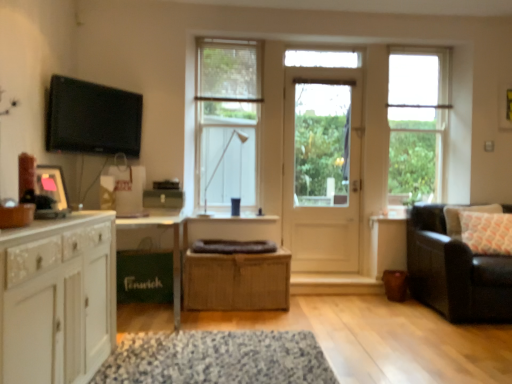
Identify the location of leather couch at right. (455, 272).

Measure the distance between point (316, 224) and camera.

Point (316, 224) is 13.48 feet away from camera.

The image size is (512, 384). Identify the location of white wooden door at center. (322, 168).

Measure the distance between point [200,350] and camera.

They are 2.49 meters apart.

This screenshot has width=512, height=384. In order to click on bamboo cabinet at center, the first cabinetry positioned from the right in this screenshot , I will do `click(236, 281)`.

The image size is (512, 384). Describe the element at coordinates (220, 162) in the screenshot. I see `matte white lamp at center` at that location.

The height and width of the screenshot is (384, 512). Find the location of `matte black picture frame at left`. matte black picture frame at left is located at coordinates (51, 192).

Does point (400, 158) lie in front of point (174, 350)?

That is False.

Looking at this image, what's the angular difference between clear glass window at upper right, acting as the 2th window starting from the left, and speckled fabric mat at center's facing directions?

There is a 0.734-degree angle between the facing directions of clear glass window at upper right, acting as the 2th window starting from the left, and speckled fabric mat at center.

Is clear glass window at upper right, placed as the first window when sorted from right to left, to the left of speckled fabric mat at center from the viewer's perspective?

Incorrect, clear glass window at upper right, placed as the first window when sorted from right to left, is not on the left side of speckled fabric mat at center.

Who is taller, white wood cabinet at left, the 1th cabinetry when ordered from front to back, or flat screen tv at upper left?

With more height is white wood cabinet at left, the 1th cabinetry when ordered from front to back.

Considering the relative sizes of white wood cabinet at left, the second cabinetry when ordered from back to front, and flat screen tv at upper left in the image provided, is white wood cabinet at left, the second cabinetry when ordered from back to front, thinner than flat screen tv at upper left?

In fact, white wood cabinet at left, the second cabinetry when ordered from back to front, might be wider than flat screen tv at upper left.

Considering their positions, is white wood cabinet at left, which appears as the first cabinetry when viewed from the left, located in front of or behind flat screen tv at upper left?

Clearly, white wood cabinet at left, which appears as the first cabinetry when viewed from the left, is in front of flat screen tv at upper left.

Is white wood cabinet at left, the second cabinetry when ordered from back to front, oriented away from flat screen tv at upper left?

No, white wood cabinet at left, the second cabinetry when ordered from back to front, is not facing away from flat screen tv at upper left.

Is leather couch at right touching clear glass window at center, which is counted as the 1th window, starting from the left?

No, leather couch at right is not touching clear glass window at center, which is counted as the 1th window, starting from the left.

This screenshot has height=384, width=512. Identify the location of studio couch directly beneath the clear glass window at center, marked as the 2th window in a right-to-left arrangement (from a real-world perspective). click(455, 272).

From the image's perspective, between leather couch at right and clear glass window at center, marked as the 2th window in a right-to-left arrangement, which one is located above?

clear glass window at center, marked as the 2th window in a right-to-left arrangement, is shown above in the image.

Is leather couch at right smaller than clear glass window at center, marked as the 2th window in a right-to-left arrangement?

No.

Is white wood cabinet at left, the 2th cabinetry when ordered from right to left, completely or partially inside matte black picture frame at left?

That's incorrect, white wood cabinet at left, the 2th cabinetry when ordered from right to left, is not inside matte black picture frame at left.

Does matte black picture frame at left appear on the right side of white wood cabinet at left, the 2th cabinetry when ordered from right to left?

No.

From a real-world perspective, between matte black picture frame at left and white wood cabinet at left, the 1th cabinetry when ordered from front to back, who is vertically lower?

In real-world perspective, white wood cabinet at left, the 1th cabinetry when ordered from front to back, is lower.

From the image's perspective, is patterned fabric pillow at right located above matte white lamp at center?

Incorrect, from the image's perspective, patterned fabric pillow at right is lower than matte white lamp at center.

Is patterned fabric pillow at right shorter than matte white lamp at center?

Yes, patterned fabric pillow at right is shorter than matte white lamp at center.

Is matte white lamp at center at the back of patterned fabric pillow at right?

No, patterned fabric pillow at right is not facing away from matte white lamp at center.

Does point (209, 199) appear closer or farther from the camera than point (283, 294)?

Point (209, 199) is positioned farther from the camera compared to point (283, 294).

Considering the relative sizes of clear glass window at center, which is counted as the 1th window, starting from the left, and bamboo cabinet at center, marked as the 2th cabinetry in a left-to-right arrangement, in the image provided, is clear glass window at center, which is counted as the 1th window, starting from the left, wider than bamboo cabinet at center, marked as the 2th cabinetry in a left-to-right arrangement,?

In fact, clear glass window at center, which is counted as the 1th window, starting from the left, might be narrower than bamboo cabinet at center, marked as the 2th cabinetry in a left-to-right arrangement.

Does clear glass window at center, marked as the 2th window in a right-to-left arrangement, appear on the left side of bamboo cabinet at center, acting as the first cabinetry starting from the back?

Yes, clear glass window at center, marked as the 2th window in a right-to-left arrangement, is to the left of bamboo cabinet at center, acting as the first cabinetry starting from the back.

Find the location of a particular element. window that appears on the left of bamboo cabinet at center, marked as the 2th cabinetry in a left-to-right arrangement is located at coordinates (227, 120).

From a real-world perspective, who is located higher, white wood cabinet at left, the second cabinetry when ordered from back to front, or clear glass window at upper right, acting as the 2th window starting from the left?

In real-world perspective, clear glass window at upper right, acting as the 2th window starting from the left, is above.

Is white wood cabinet at left, the 2th cabinetry when ordered from right to left, beside clear glass window at upper right, placed as the first window when sorted from right to left?

No, white wood cabinet at left, the 2th cabinetry when ordered from right to left, is not beside clear glass window at upper right, placed as the first window when sorted from right to left.

Looking at this image, is white wood cabinet at left, the second cabinetry when ordered from back to front, wider or thinner than clear glass window at upper right, acting as the 2th window starting from the left?

white wood cabinet at left, the second cabinetry when ordered from back to front, is wider than clear glass window at upper right, acting as the 2th window starting from the left.

Identify the location of mat that is under the clear glass window at upper right, placed as the first window when sorted from right to left (from a real-world perspective). (217, 358).

Find the location of a particular element. cabinetry that is the 1st one when counting rightward from the flat screen tv at upper left is located at coordinates [x=57, y=298].

When comparing their distances from white wood cabinet at left, the second cabinetry when ordered from back to front, does patterned fabric pillow at right or bamboo cabinet at center, acting as the first cabinetry starting from the back, seem closer?

bamboo cabinet at center, acting as the first cabinetry starting from the back, lies closer to white wood cabinet at left, the second cabinetry when ordered from back to front, than the other object.

Based on their spatial positions, is leather couch at right or matte black picture frame at left closer to white wooden door at center?

Among the two, leather couch at right is located nearer to white wooden door at center.

In the scene shown: Based on their spatial positions, is white wooden door at center or flat screen tv at upper left closer to leather couch at right?

white wooden door at center is positioned closer to the anchor leather couch at right.

Based on their spatial positions, is white wooden door at center or matte white lamp at center further from speckled fabric mat at center?

matte white lamp at center is further to speckled fabric mat at center.

Considering their positions, is clear glass window at upper right, acting as the 2th window starting from the left, positioned further to patterned fabric pillow at right than matte blue cup at center?

matte blue cup at center.

When comparing their distances from white wood cabinet at left, the 2th cabinetry when ordered from right to left, does matte black picture frame at left or bamboo cabinet at center, arranged as the second cabinetry when viewed from the front, seem closer?

The object closer to white wood cabinet at left, the 2th cabinetry when ordered from right to left, is matte black picture frame at left.

Consider the image. Based on their spatial positions, is clear glass window at center, marked as the 2th window in a right-to-left arrangement, or clear glass window at upper right, acting as the 2th window starting from the left, closer to patterned fabric pillow at right?

Among the two, clear glass window at upper right, acting as the 2th window starting from the left, is located nearer to patterned fabric pillow at right.

Considering their positions, is bamboo cabinet at center, acting as the first cabinetry starting from the back, positioned closer to matte black picture frame at left than flat screen tv at upper left?

flat screen tv at upper left is closer to matte black picture frame at left.

This screenshot has height=384, width=512. What are the coordinates of `pillow located between bamboo cabinet at center, acting as the first cabinetry starting from the back, and leather couch at right in the left-right direction` in the screenshot? It's located at (464, 210).

Locate an element on the screen. picture frame between speckled fabric mat at center and white wooden door at center from front to back is located at coordinates (51, 192).

Where is `window between white wooden door at center and patterned fabric pillow at right`? The image size is (512, 384). window between white wooden door at center and patterned fabric pillow at right is located at coordinates (416, 123).

This screenshot has height=384, width=512. Find the location of `coffee cup situated between matte black picture frame at left and leather couch at right from left to right`. coffee cup situated between matte black picture frame at left and leather couch at right from left to right is located at coordinates (234, 206).